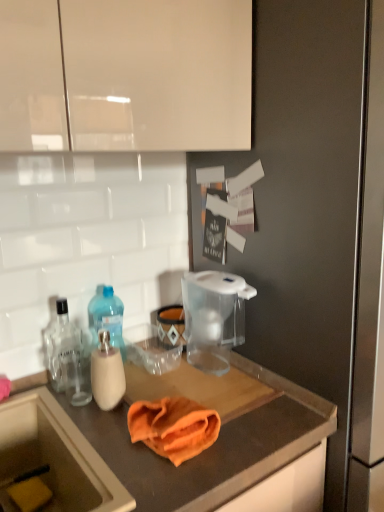
What are the coordinates of `vacant space to the right of orange microfiber cloth at center` in the screenshot? It's located at (251, 426).